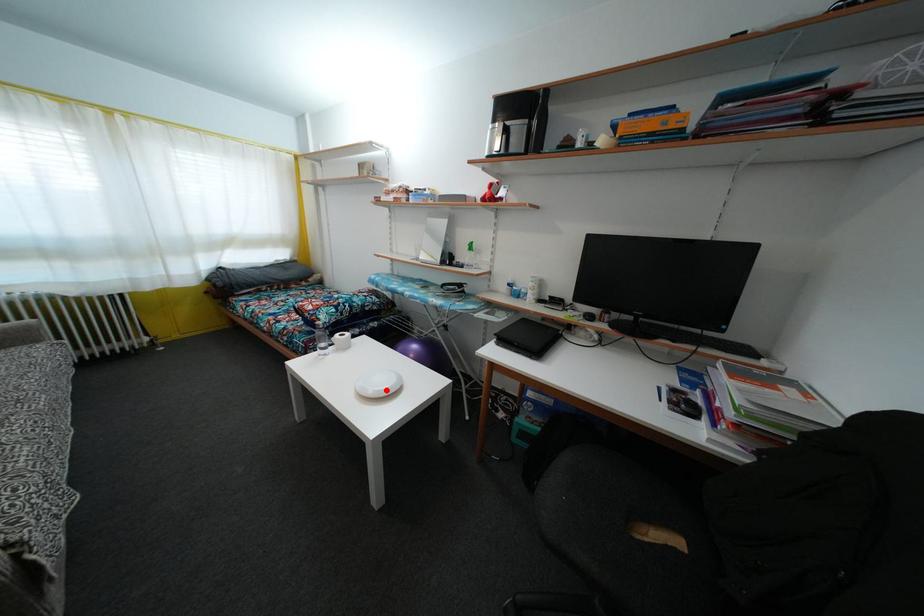
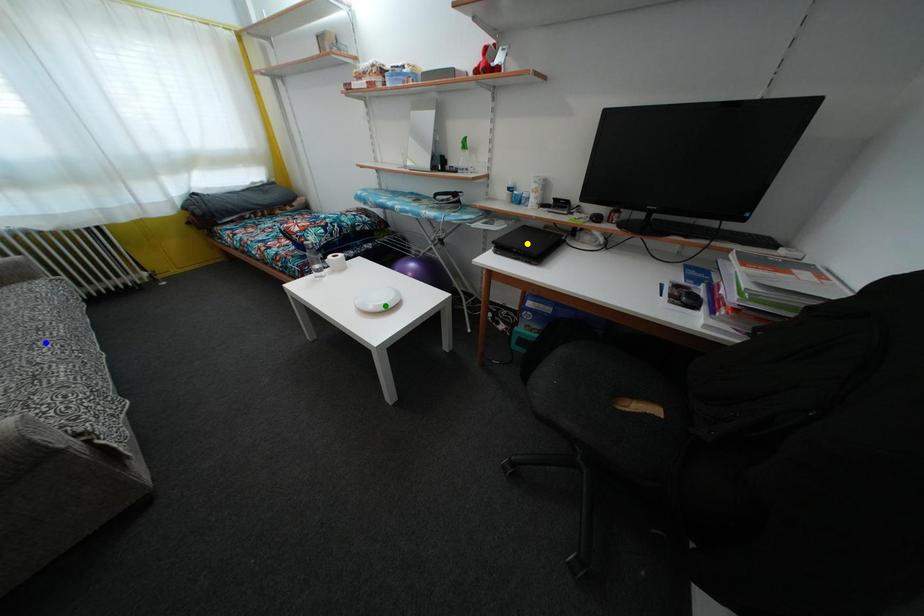
Question: I am providing you with two images of the same scene from different viewpoints. A red point is marked on the first image. You are given multiple points on the second image. Which point in image 2 is actually the same real-world point as the red point in image 1?

Choices:
 (A) blue point
 (B) yellow point
 (C) green point

Answer: (C)